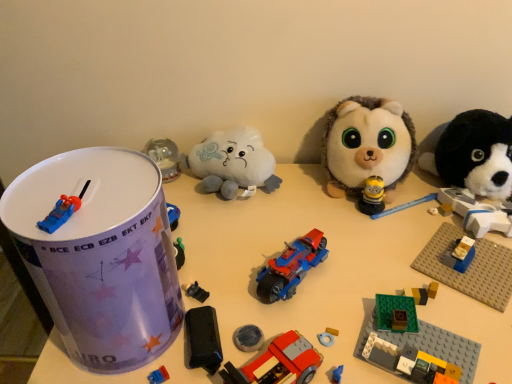
This screenshot has width=512, height=384. I want to click on free space in front of shiny plastic motorcycle at center, which is the sixth toy in left-to-right order, so click(295, 329).